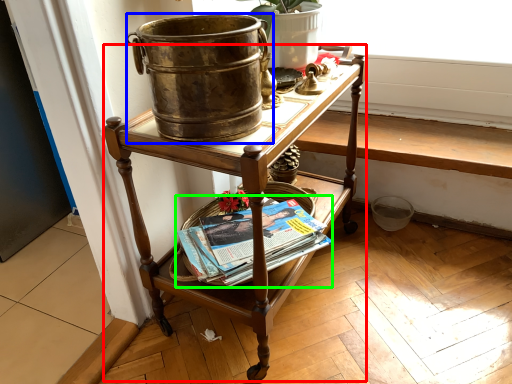
Question: Which object is positioned farthest from desk (highlighted by a red box)? Select from flowerpot (highlighted by a blue box) and paperback book (highlighted by a green box).

Choices:
 (A) flowerpot
 (B) paperback book

Answer: (A)